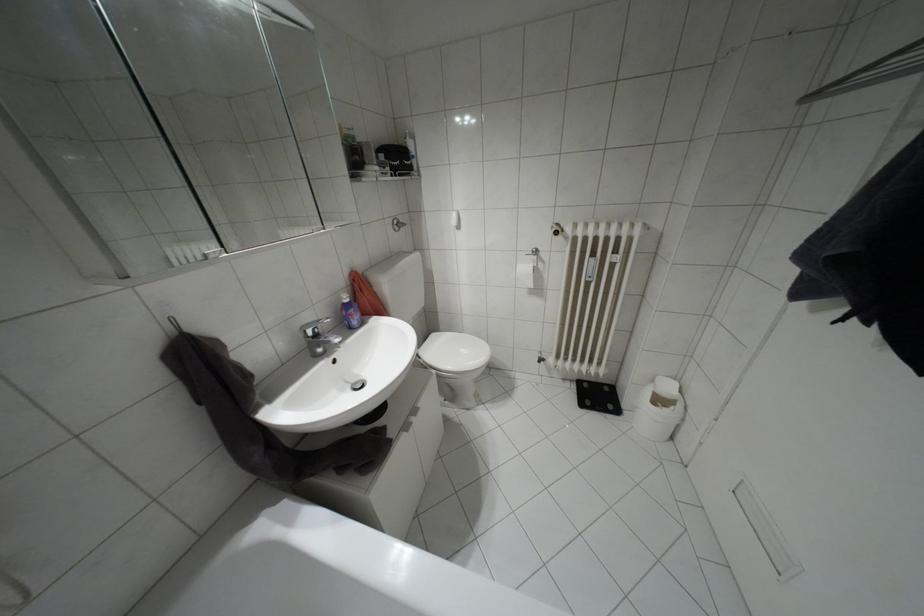
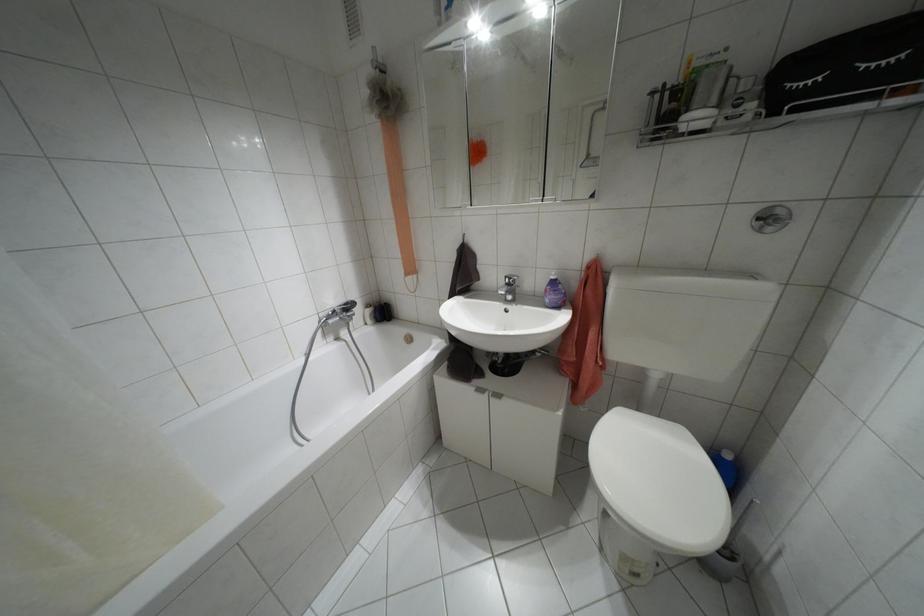
The point at (395, 229) is marked in the first image. Where is the corresponding point in the second image?

(769, 228)